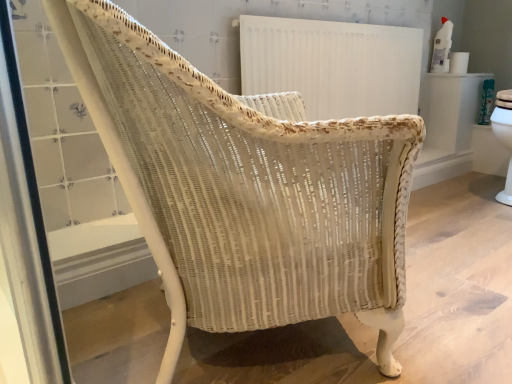
Question: Looking at the image, does white paper towel at upper right seem bigger or smaller compared to white textured radiator at upper center?

Choices:
 (A) big
 (B) small

Answer: (B)

Question: From a real-world perspective, is white paper towel at upper right above or below white textured radiator at upper center?

Choices:
 (A) below
 (B) above

Answer: (B)

Question: Considering their positions, is white paper towel at upper right located in front of or behind white textured radiator at upper center?

Choices:
 (A) front
 (B) behind

Answer: (B)

Question: From a real-world perspective, is white textured radiator at upper center above or below white paper towel at upper right?

Choices:
 (A) above
 (B) below

Answer: (B)

Question: Is white textured radiator at upper center spatially inside white paper towel at upper right, or outside of it?

Choices:
 (A) inside
 (B) outside

Answer: (B)

Question: Is white textured radiator at upper center taller or shorter than white paper towel at upper right?

Choices:
 (A) tall
 (B) short

Answer: (A)

Question: Is point (282, 59) positioned closer to the camera than point (450, 59)?

Choices:
 (A) farther
 (B) closer

Answer: (B)